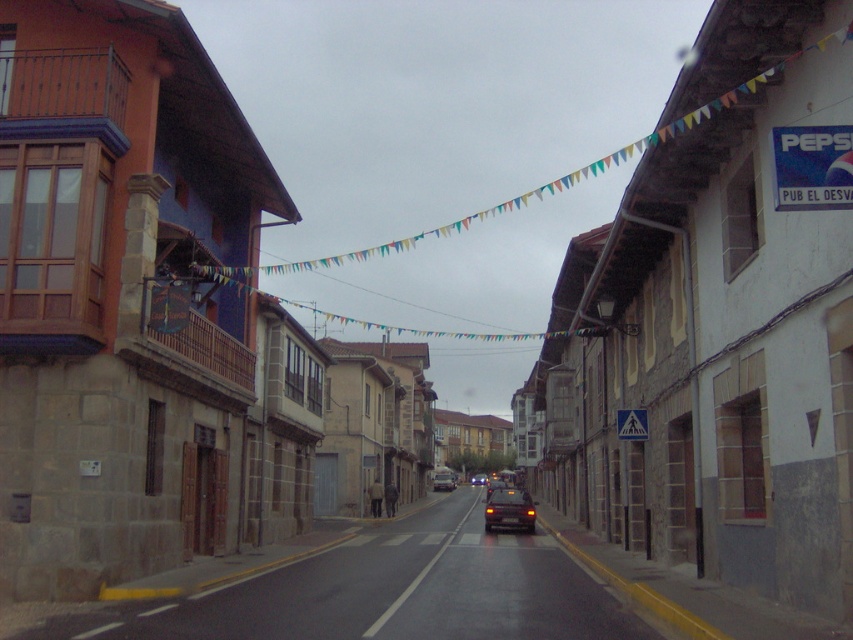
Question: Is shiny dark red car at center to the left of shiny red car at center from the viewer's perspective?

Choices:
 (A) yes
 (B) no

Answer: (A)

Question: Among these objects, which one is farthest from the camera?

Choices:
 (A) shiny black sedan at center
 (B) shiny red car at center

Answer: (A)

Question: Which point appears closest to the camera in this image?

Choices:
 (A) coord(454,483)
 (B) coord(483,483)

Answer: (A)

Question: Does shiny dark red car at center lie in front of shiny black sedan at center?

Choices:
 (A) yes
 (B) no

Answer: (A)

Question: Which object appears closest to the camera in this image?

Choices:
 (A) shiny dark red car at center
 (B) metallic silver car at center

Answer: (A)

Question: Does shiny dark red car at center come in front of shiny black sedan at center?

Choices:
 (A) no
 (B) yes

Answer: (B)